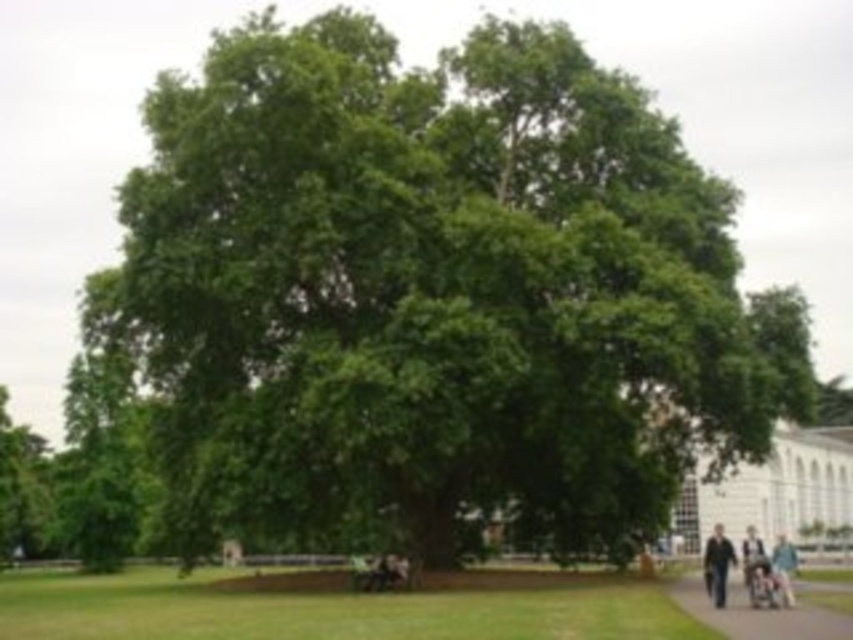
You are a gardener planning to install a new flower bed along the edge of the smooth asphalt path at lower right and the dark gray pants at lower right. Which object should you consider for the flower bed placement to ensure it doesn t interfere with the existing structures?

The smooth asphalt path at lower right is thinner than the dark gray pants at lower right, so you should place the flower bed near the dark gray pants at lower right since it has more space available.